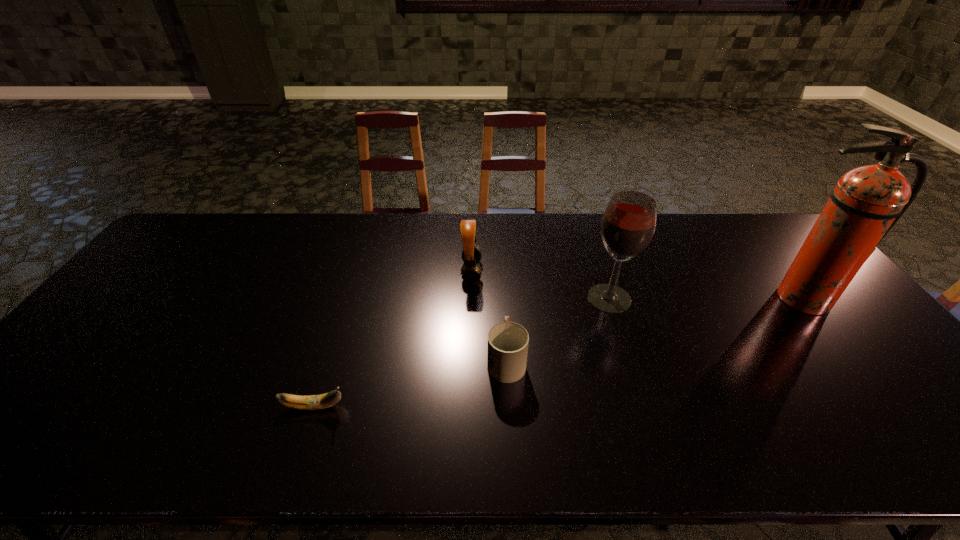
Find the location of `the tallest object`. the tallest object is located at coordinates (867, 202).

I want to click on the rightmost object, so click(x=867, y=202).

Find the location of a particular element. the second tallest object is located at coordinates (628, 224).

Find the location of a particular element. The width and height of the screenshot is (960, 540). alcohol is located at coordinates (628, 224).

This screenshot has height=540, width=960. What are the coordinates of `headset` in the screenshot? It's located at point(471,255).

Locate an element on the screen. The height and width of the screenshot is (540, 960). the third tallest object is located at coordinates (471, 255).

I want to click on the fourth farthest object, so click(x=508, y=342).

Where is `cup`? cup is located at coordinates (508, 342).

Image resolution: width=960 pixels, height=540 pixels. What are the coordinates of `banana` in the screenshot? It's located at (311, 402).

Identify the location of the shortest object. (311, 402).